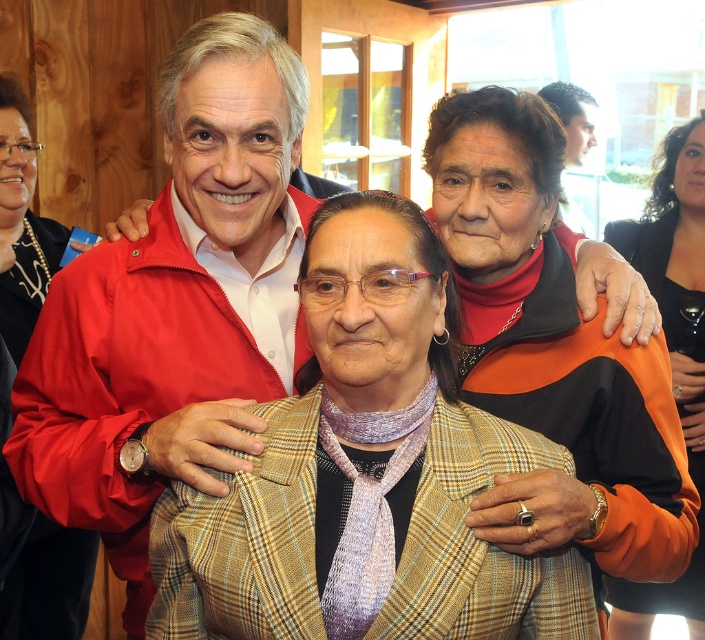
Question: Which point appears closest to the camera in this image?

Choices:
 (A) (417, 541)
 (B) (6, 339)
 (C) (250, 301)

Answer: (A)

Question: Among these points, which one is farthest from the camera?

Choices:
 (A) (692, 452)
 (B) (39, 221)
 (C) (329, 621)
 (D) (219, 339)

Answer: (A)

Question: Does plaid fabric jacket at center lie in front of matte red jacket at center?

Choices:
 (A) yes
 (B) no

Answer: (A)

Question: Does plaid fabric jacket at center appear on the right side of orange fabric jacket at upper right?

Choices:
 (A) yes
 (B) no

Answer: (B)

Question: Is plaid fabric jacket at center smaller than matte orange sweater at center?

Choices:
 (A) yes
 (B) no

Answer: (A)

Question: Which of these objects is positioned closest to the black matte jacket at upper left?

Choices:
 (A) orange fabric jacket at upper right
 (B) plaid fabric jacket at center
 (C) matte orange sweater at center

Answer: (B)